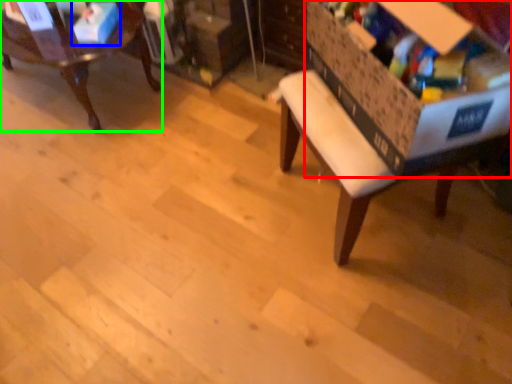
Question: Considering the real-world distances, which object is farthest from storage box (highlighted by a red box)? storage box (highlighted by a blue box) or chair (highlighted by a green box)?

Choices:
 (A) storage box
 (B) chair

Answer: (A)